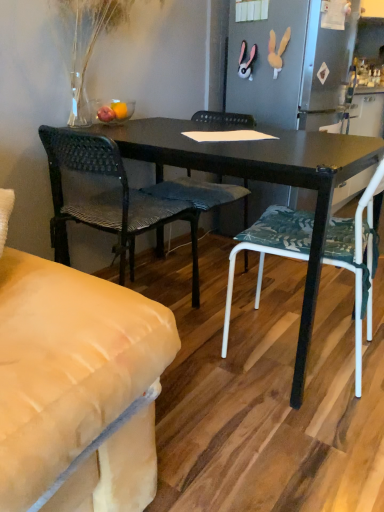
Describe the element at coordinates (108, 200) in the screenshot. I see `woven fabric chair at center, the third chair in the right-to-left sequence` at that location.

Image resolution: width=384 pixels, height=512 pixels. I want to click on woven fabric chair at center, placed as the second chair when sorted from left to right, so click(201, 193).

The width and height of the screenshot is (384, 512). Identify the location of white fabric chair at center, arranged as the 3th chair when viewed from the left. (356, 260).

Locate an element on the screen. This screenshot has height=512, width=384. woven fabric chair at center, which is the 1th chair from left to right is located at coordinates (108, 200).

Does woven fabric chair at center, which is the 1th chair from left to right, have a greater height compared to white fabric chair at center, arranged as the 3th chair when viewed from the left?

Yes, woven fabric chair at center, which is the 1th chair from left to right, is taller than white fabric chair at center, arranged as the 3th chair when viewed from the left.

Between woven fabric chair at center, which is the 1th chair from left to right, and white fabric chair at center, arranged as the 1th chair when viewed from the right, which one has smaller width?

woven fabric chair at center, which is the 1th chair from left to right.

Is woven fabric chair at center, which is the 1th chair from left to right, positioned with its back to white fabric chair at center, arranged as the 1th chair when viewed from the right?

No.

Measure the distance from woven fabric chair at center, the third chair in the right-to-left sequence, to white fabric chair at center, arranged as the 1th chair when viewed from the right.

woven fabric chair at center, the third chair in the right-to-left sequence, is 53.05 centimeters away from white fabric chair at center, arranged as the 1th chair when viewed from the right.

From the image's perspective, would you say woven fabric chair at center, arranged as the 2th chair when viewed from the right, is positioned over white fabric chair at center, arranged as the 3th chair when viewed from the left?

Correct, woven fabric chair at center, arranged as the 2th chair when viewed from the right, appears higher than white fabric chair at center, arranged as the 3th chair when viewed from the left, in the image.

Is woven fabric chair at center, arranged as the 2th chair when viewed from the right, positioned in front of white fabric chair at center, arranged as the 1th chair when viewed from the right?

No, it is behind white fabric chair at center, arranged as the 1th chair when viewed from the right.

From a real-world perspective, is woven fabric chair at center, placed as the second chair when sorted from left to right, physically above white fabric chair at center, arranged as the 3th chair when viewed from the left?

No.

Is white fabric chair at center, arranged as the 1th chair when viewed from the right, inside the boundaries of woven fabric chair at center, which is the 1th chair from left to right, or outside?

white fabric chair at center, arranged as the 1th chair when viewed from the right, is not enclosed by woven fabric chair at center, which is the 1th chair from left to right.

From a real-world perspective, count 2nd chairs downward from the white fabric chair at center, arranged as the 1th chair when viewed from the right, and point to it. Please provide its 2D coordinates.

[(108, 200)]

Is white fabric chair at center, arranged as the 1th chair when viewed from the right, at the right side of woven fabric chair at center, which is the 1th chair from left to right?

Indeed, white fabric chair at center, arranged as the 1th chair when viewed from the right, is positioned on the right side of woven fabric chair at center, which is the 1th chair from left to right.

Which is more to the right, woven fabric chair at center, the third chair in the right-to-left sequence, or woven fabric chair at center, arranged as the 2th chair when viewed from the right?

Positioned to the right is woven fabric chair at center, arranged as the 2th chair when viewed from the right.

Which of these two, woven fabric chair at center, which is the 1th chair from left to right, or woven fabric chair at center, placed as the second chair when sorted from left to right, is wider?

With larger width is woven fabric chair at center, placed as the second chair when sorted from left to right.

Is woven fabric chair at center, the third chair in the right-to-left sequence, far from woven fabric chair at center, placed as the second chair when sorted from left to right?

No, woven fabric chair at center, the third chair in the right-to-left sequence, is in close proximity to woven fabric chair at center, placed as the second chair when sorted from left to right.

From a real-world perspective, is woven fabric chair at center, the third chair in the right-to-left sequence, positioned over woven fabric chair at center, placed as the second chair when sorted from left to right, based on gravity?

No.

What's the angular difference between white fabric chair at center, arranged as the 3th chair when viewed from the left, and woven fabric chair at center, arranged as the 2th chair when viewed from the right,'s facing directions?

The facing directions of white fabric chair at center, arranged as the 3th chair when viewed from the left, and woven fabric chair at center, arranged as the 2th chair when viewed from the right, are 81.6 degrees apart.

Is white fabric chair at center, arranged as the 3th chair when viewed from the left, looking in the opposite direction of woven fabric chair at center, placed as the second chair when sorted from left to right?

No, white fabric chair at center, arranged as the 3th chair when viewed from the left, is not facing the opposite direction of woven fabric chair at center, placed as the second chair when sorted from left to right.

Is white fabric chair at center, arranged as the 3th chair when viewed from the left, positioned far away from woven fabric chair at center, arranged as the 2th chair when viewed from the right?

No, white fabric chair at center, arranged as the 3th chair when viewed from the left, is in close proximity to woven fabric chair at center, arranged as the 2th chair when viewed from the right.

Would you say woven fabric chair at center, placed as the second chair when sorted from left to right, is to the left or to the right of woven fabric chair at center, the third chair in the right-to-left sequence, in the picture?

Based on their positions, woven fabric chair at center, placed as the second chair when sorted from left to right, is located to the right of woven fabric chair at center, the third chair in the right-to-left sequence.

Based on their sizes in the image, would you say woven fabric chair at center, placed as the second chair when sorted from left to right, is bigger or smaller than woven fabric chair at center, which is the 1th chair from left to right?

woven fabric chair at center, placed as the second chair when sorted from left to right, is bigger than woven fabric chair at center, which is the 1th chair from left to right.

Considering the sizes of woven fabric chair at center, placed as the second chair when sorted from left to right, and woven fabric chair at center, the third chair in the right-to-left sequence, in the image, is woven fabric chair at center, placed as the second chair when sorted from left to right, wider or thinner than woven fabric chair at center, the third chair in the right-to-left sequence,?

woven fabric chair at center, placed as the second chair when sorted from left to right, is wider than woven fabric chair at center, the third chair in the right-to-left sequence.

Is woven fabric chair at center, placed as the second chair when sorted from left to right, oriented away from woven fabric chair at center, which is the 1th chair from left to right?

Yes, woven fabric chair at center, which is the 1th chair from left to right, is at the back of woven fabric chair at center, placed as the second chair when sorted from left to right.

The image size is (384, 512). In order to click on the 1st chair behind the white fabric chair at center, arranged as the 3th chair when viewed from the left in this screenshot , I will do `click(108, 200)`.

Where is `the 1st chair counting from the left of the white fabric chair at center, arranged as the 3th chair when viewed from the left`? the 1st chair counting from the left of the white fabric chair at center, arranged as the 3th chair when viewed from the left is located at coordinates (201, 193).

Looking at the image, which one is located closer to woven fabric chair at center, the third chair in the right-to-left sequence, woven fabric chair at center, placed as the second chair when sorted from left to right, or white fabric chair at center, arranged as the 1th chair when viewed from the right?

woven fabric chair at center, placed as the second chair when sorted from left to right.

When comparing their distances from woven fabric chair at center, placed as the second chair when sorted from left to right, does woven fabric chair at center, the third chair in the right-to-left sequence, or white fabric chair at center, arranged as the 1th chair when viewed from the right, seem further?

The object further to woven fabric chair at center, placed as the second chair when sorted from left to right, is white fabric chair at center, arranged as the 1th chair when viewed from the right.

Looking at the image, which one is located closer to white fabric chair at center, arranged as the 3th chair when viewed from the left, woven fabric chair at center, placed as the second chair when sorted from left to right, or woven fabric chair at center, which is the 1th chair from left to right?

woven fabric chair at center, placed as the second chair when sorted from left to right, is closer to white fabric chair at center, arranged as the 3th chair when viewed from the left.

Considering their positions, is white fabric chair at center, arranged as the 1th chair when viewed from the right, positioned further to woven fabric chair at center, placed as the second chair when sorted from left to right, than woven fabric chair at center, the third chair in the right-to-left sequence?

white fabric chair at center, arranged as the 1th chair when viewed from the right.

When comparing their distances from white fabric chair at center, arranged as the 1th chair when viewed from the right, does woven fabric chair at center, the third chair in the right-to-left sequence, or woven fabric chair at center, arranged as the 2th chair when viewed from the right, seem closer?

woven fabric chair at center, arranged as the 2th chair when viewed from the right, lies closer to white fabric chair at center, arranged as the 1th chair when viewed from the right, than the other object.

In the scene shown: Estimate the real-world distances between objects in this image. Which object is further from woven fabric chair at center, which is the 1th chair from left to right, white fabric chair at center, arranged as the 3th chair when viewed from the left, or woven fabric chair at center, arranged as the 2th chair when viewed from the right?

white fabric chair at center, arranged as the 3th chair when viewed from the left.

Where is `chair situated between woven fabric chair at center, the third chair in the right-to-left sequence, and white fabric chair at center, arranged as the 1th chair when viewed from the right, from left to right`? This screenshot has height=512, width=384. chair situated between woven fabric chair at center, the third chair in the right-to-left sequence, and white fabric chair at center, arranged as the 1th chair when viewed from the right, from left to right is located at coordinates (201, 193).